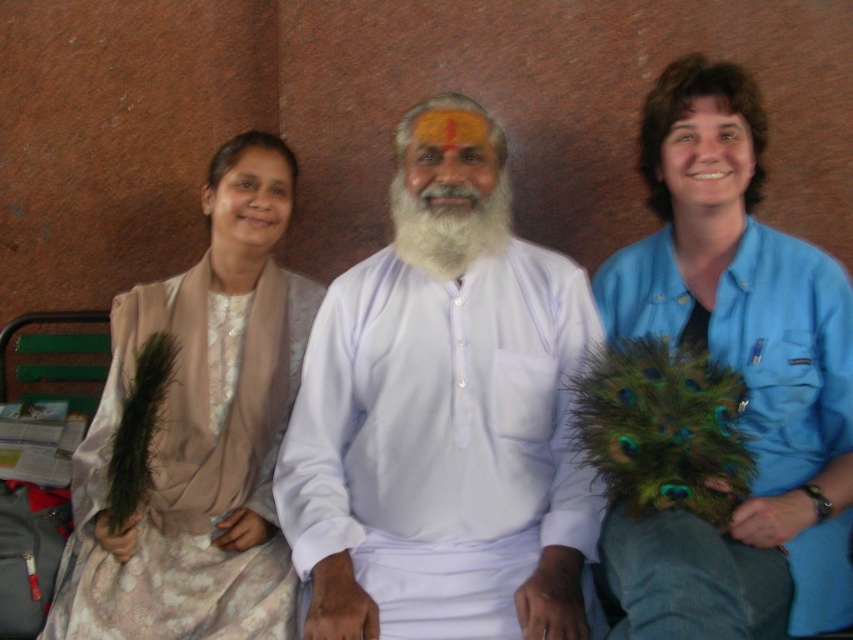
You are organizing a photo shoot and need to ensure that the white matte shirt at center and the matte beige scarf at left are visible in the frame. Based on their sizes, which object should you prioritize placing closer to the camera to maintain clarity?

The white matte shirt at center should be placed closer to the camera because it has a smaller size compared to the matte beige scarf at left, ensuring both objects are clearly visible in the frame.

You are an observer standing in front of the image. You see the white matte shirt at center and the matte beige scarf at left. Which object is covering part of the other?

The white matte shirt at center is positioned over the matte beige scarf at left, so it is covering part of it.